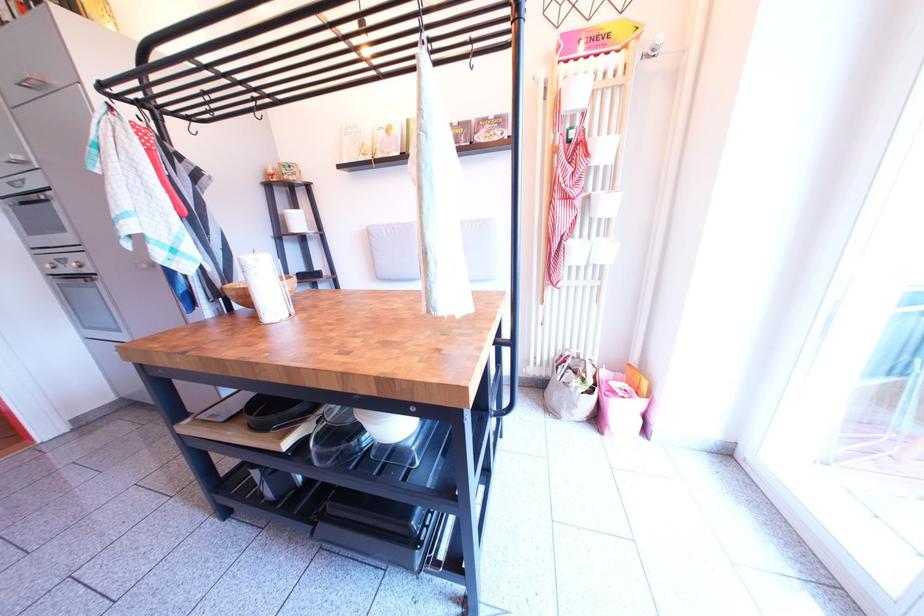
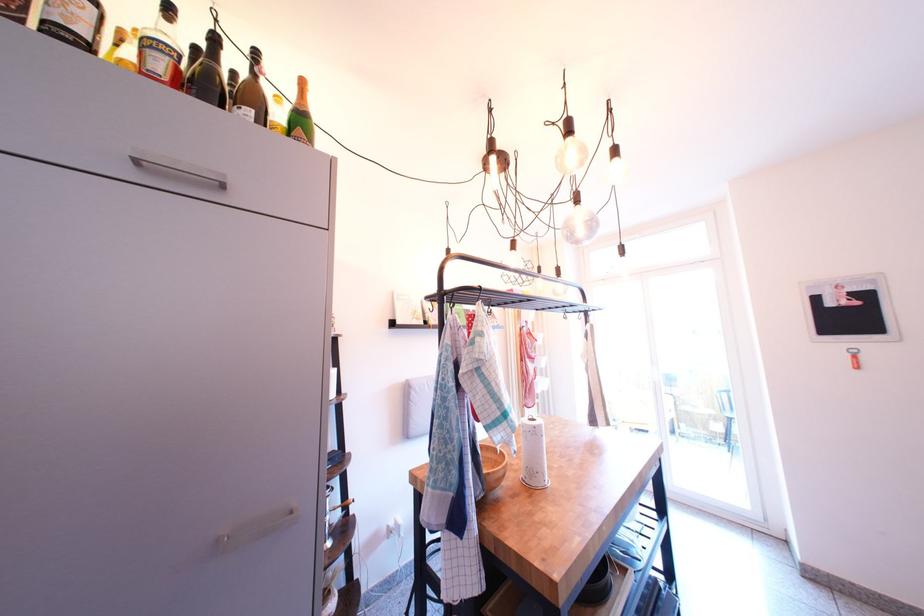
Question: I am providing you with two images of the same scene from different viewpoints. After the viewpoint changes to image2, which objects are now occluded?

Choices:
 (A) wooden bowl
 (B) orange suitcase
 (C) green champagne bottle
 (D) white plate

Answer: (D)